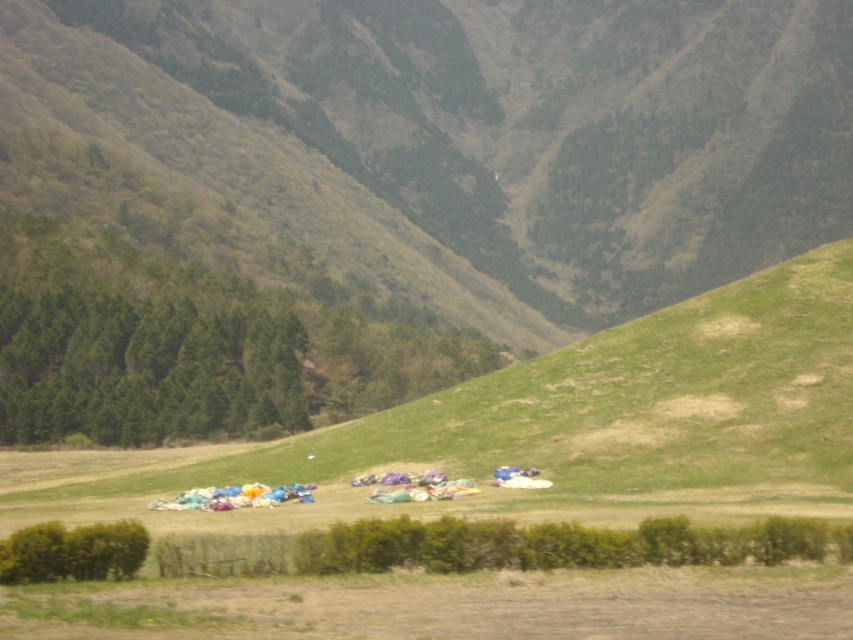
You are standing at the point labeled as point (384, 189) in the image. What is the immediate terrain feature you are currently standing on?

The point (384, 189) is on the green grassy hillside at center.

You are standing at the point marked as point [576,424] in the image. What do you see directly in front of you?

At point [576,424] lies green grassy field at lower center, so directly in front of you is the green grassy field at lower center.

You are standing on the neatly trimmed hedge in the foreground and want to walk towards the multicolored fabric at center. Which direction should you walk to reach it from the green grassy field at lower center?

The green grassy field at lower center is to the left of the multicolored fabric at center. To reach the multicolored fabric at center from the green grassy field at lower center, you should walk to the right.